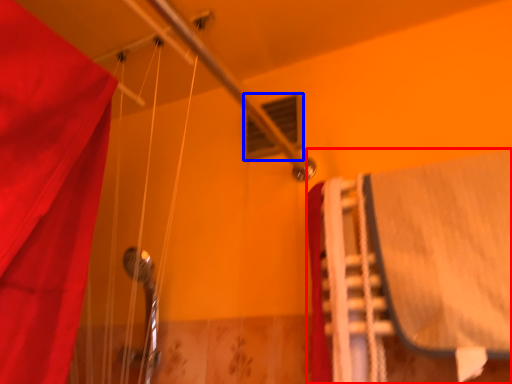
Question: Which point is further to the camera, bed (highlighted by a red box) or window (highlighted by a blue box)?

Choices:
 (A) bed
 (B) window

Answer: (B)